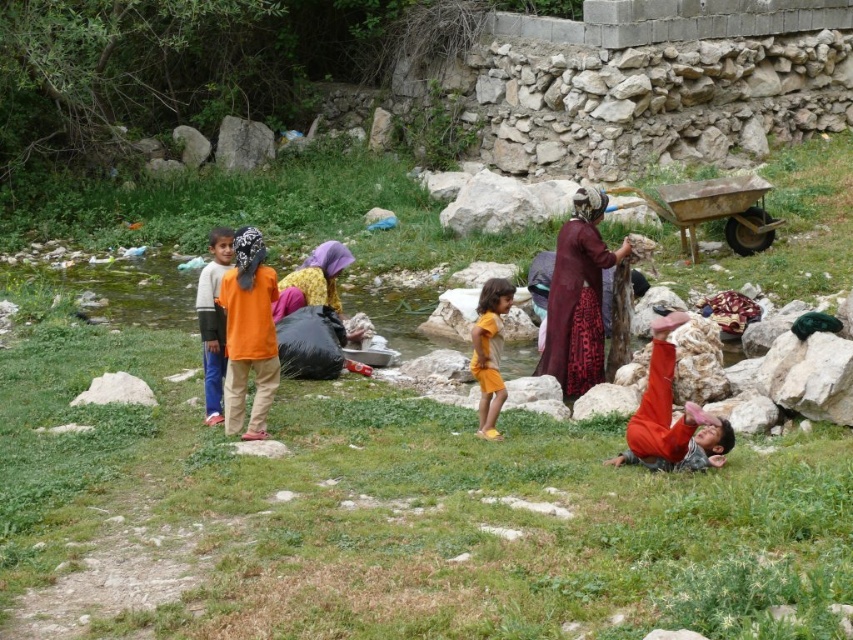
You are a traveler who just arrived at the stream and you see the orange cotton shirt at center and the orange fabric headscarf at center. Which of these two items is smaller in size?

The orange cotton shirt at center is smaller in size compared to the orange fabric headscarf at center.

You are a photographer trying to capture a detailed shot of both the yellow matte shorts at center and the orange fabric headscarf at center. Since you want to focus on the smaller object first, which one should you adjust your camera to focus on first?

The yellow matte shorts at center occupies less space than the orange fabric headscarf at center, so you should focus on the yellow matte shorts at center first as it is smaller.